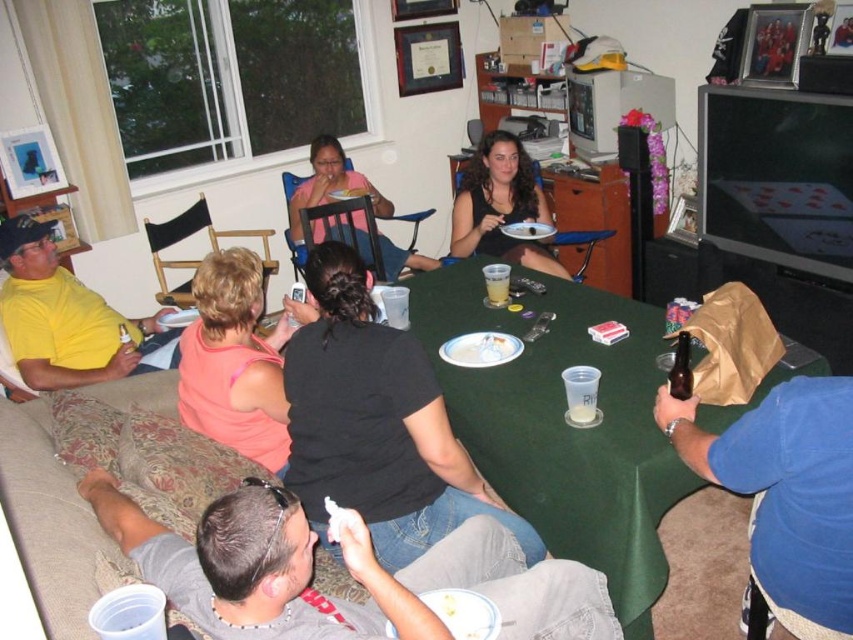
Between gray fabric couch at lower left and black matte shirt at center, which one is positioned higher?

black matte shirt at center is higher up.

Is gray fabric couch at lower left wider than black matte shirt at center?

Yes, gray fabric couch at lower left is wider than black matte shirt at center.

Which is behind, point (103, 525) or point (296, 396)?

Point (296, 396)

The height and width of the screenshot is (640, 853). Find the location of `gray fabric couch at lower left`. gray fabric couch at lower left is located at coordinates (347, 570).

Describe the element at coordinates (61, 316) in the screenshot. The height and width of the screenshot is (640, 853). I see `yellow matte shirt at left` at that location.

Can you confirm if yellow matte shirt at left is taller than pink matte shirt at upper center?

In fact, yellow matte shirt at left may be shorter than pink matte shirt at upper center.

I want to click on yellow matte shirt at left, so click(61, 316).

Consider the image. Can you confirm if black matte shirt at center is taller than black fabric shirt at center?

Correct, black matte shirt at center is much taller as black fabric shirt at center.

Can you confirm if black matte shirt at center is thinner than black fabric shirt at center?

No.

What do you see at coordinates (376, 422) in the screenshot? I see `black matte shirt at center` at bounding box center [376, 422].

At what (x,y) coordinates should I click in order to perform the action: click on black matte shirt at center. Please return your answer as a coordinate pair (x, y). The image size is (853, 640). Looking at the image, I should click on (376, 422).